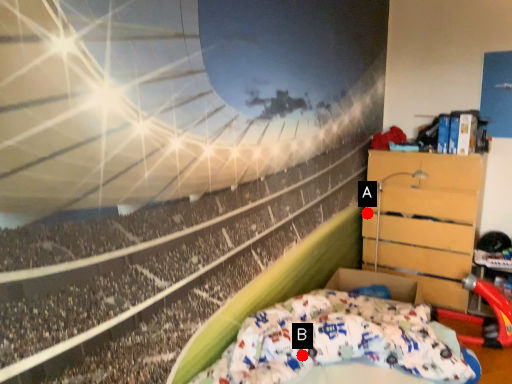
Question: Two points are circled on the image, labeled by A and B beside each circle. Which point appears farthest from the camera in this image?

Choices:
 (A) A is further
 (B) B is further

Answer: (A)